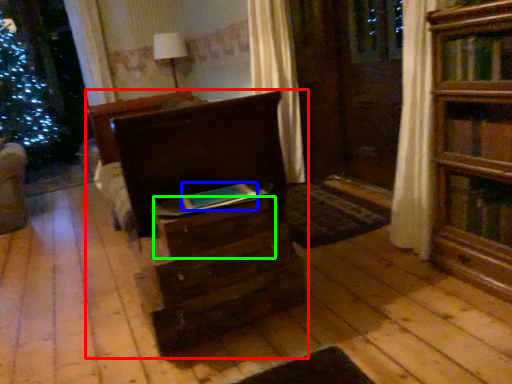
Question: Considering the real-world distances, which object is closest to chest of drawers (highlighted by a red box)? book (highlighted by a blue box) or drawer (highlighted by a green box).

Choices:
 (A) book
 (B) drawer

Answer: (B)